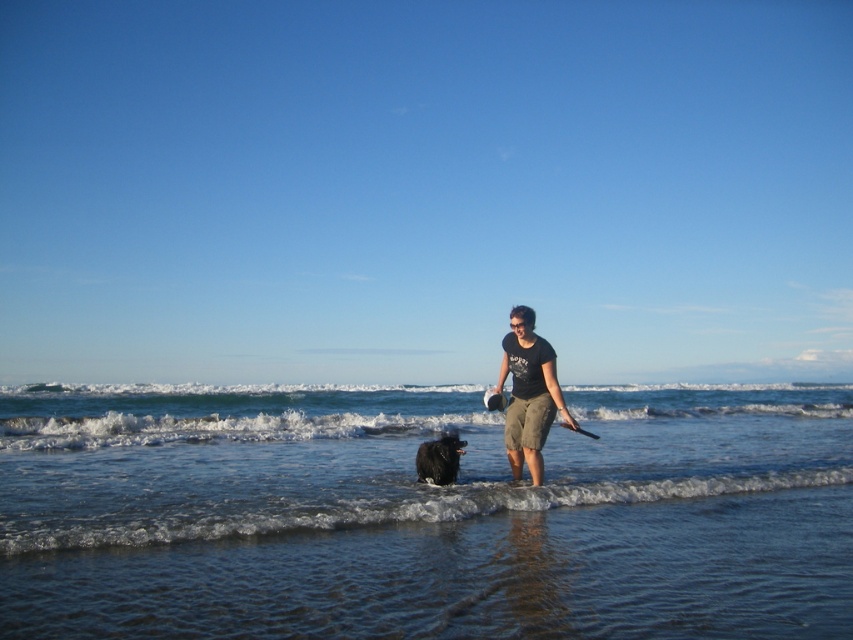
Question: Which point appears closest to the camera in this image?

Choices:
 (A) (526, 342)
 (B) (451, 467)
 (C) (38, 483)

Answer: (A)

Question: Based on their relative distances, which object is nearer to the clear water at lower center?

Choices:
 (A) matte black t-shirt at center
 (B) black fluffy dog at center

Answer: (A)

Question: Is the position of matte black t-shirt at center more distant than that of black fluffy dog at center?

Choices:
 (A) yes
 (B) no

Answer: (B)

Question: Does clear water at lower center come behind matte black t-shirt at center?

Choices:
 (A) no
 (B) yes

Answer: (A)

Question: Among these points, which one is farthest from the camera?

Choices:
 (A) (824, 592)
 (B) (424, 465)
 (C) (543, 396)

Answer: (B)

Question: Can you confirm if clear water at lower center is positioned to the right of black fluffy dog at center?

Choices:
 (A) yes
 (B) no

Answer: (A)